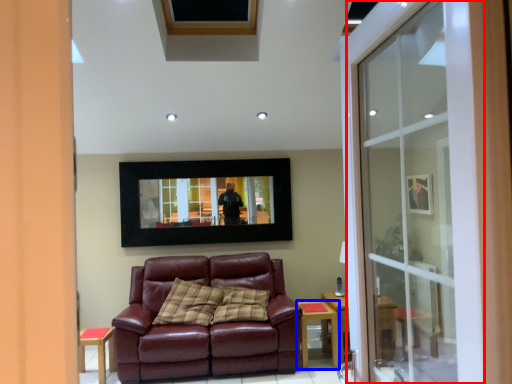
Question: Which point is closer to the camera, screen door (highlighted by a red box) or table (highlighted by a blue box)?

Choices:
 (A) screen door
 (B) table

Answer: (A)